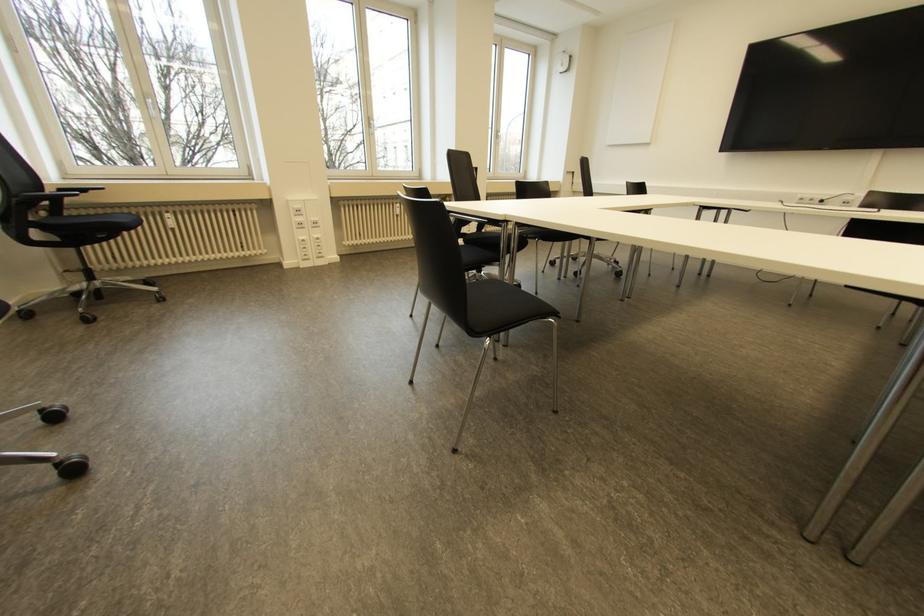
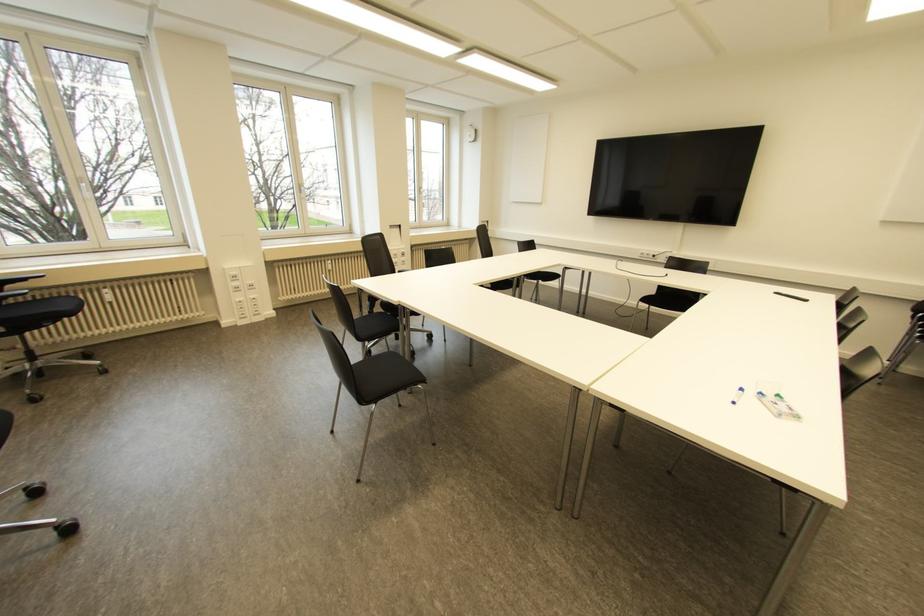
Where in the second image is the point corresponding to point 166,215 from the first image?

(104, 290)